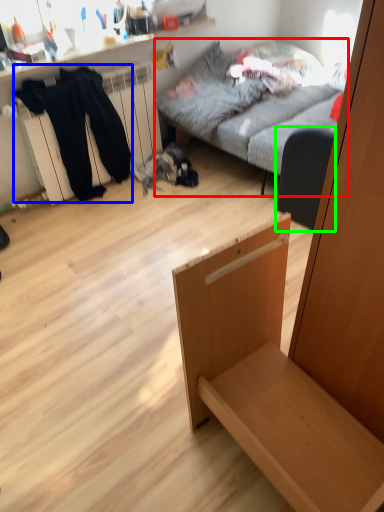
Question: Which object is positioned farthest from studio couch (highlighted by a red box)? Select from clothing (highlighted by a blue box) and armchair (highlighted by a green box).

Choices:
 (A) clothing
 (B) armchair

Answer: (A)